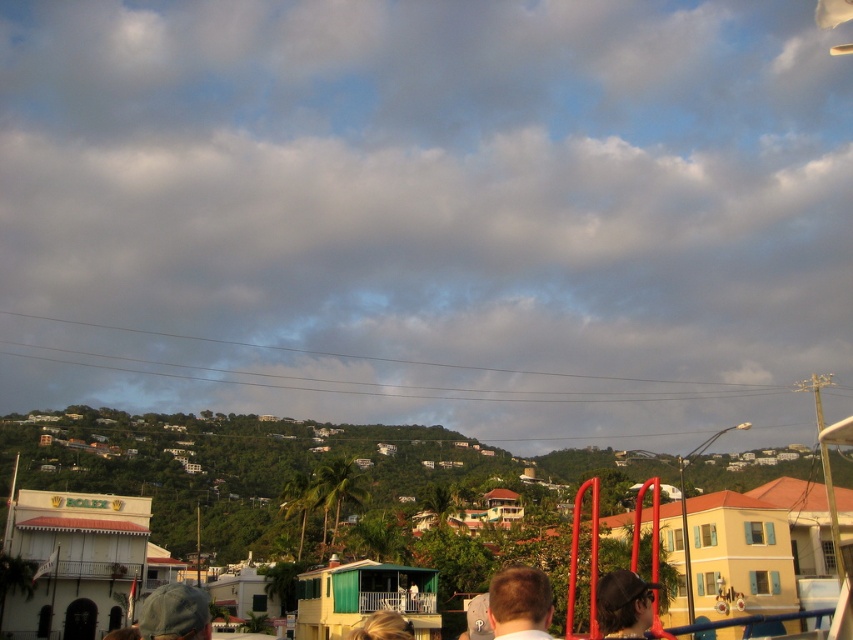
Based on the photo, you are a photographer trying to capture both the camouflage fabric cap at lower left and the matte black cap at center in a single shot. Which cap should you adjust your focus on to ensure the other is still in the frame?

The camouflage fabric cap at lower left is in front of the matte black cap at center, so focusing on the matte black cap at center would keep both in the frame as the camouflage cap is closer and would remain within the depth of field.

You are a photographer trying to capture a closeup of the matte black cap at center and the blonde hair at lower center. Which object should you zoom in on to ensure it takes up more of the frame without moving the camera?

The blonde hair at lower center should be zoomed in on because it occupies more space than the matte black cap at center, allowing it to fill the frame better without moving the camera.